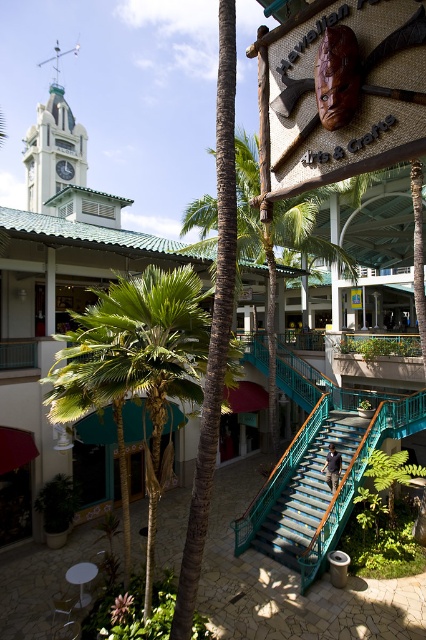
Does point (149, 600) come in front of point (348, 452)?

Yes, point (149, 600) is in front of point (348, 452).

Is green leafy palm tree at center positioned before teal metal stairs at center?

Yes, green leafy palm tree at center is in front of teal metal stairs at center.

Where is `green leafy palm tree at center`? Image resolution: width=426 pixels, height=640 pixels. green leafy palm tree at center is located at coordinates (137, 364).

I want to click on teal metal stairs at center, so click(307, 492).

Between green leafy palm tree at center and green painted metal clock tower at upper left, which one appears on the left side from the viewer's perspective?

green painted metal clock tower at upper left is more to the left.

Locate an element on the screen. green leafy palm tree at center is located at coordinates (137, 364).